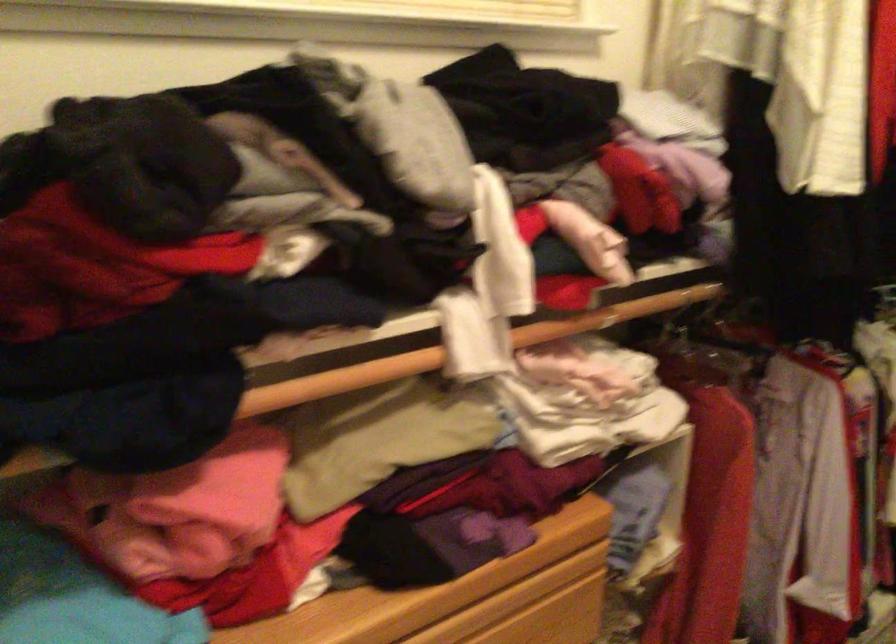
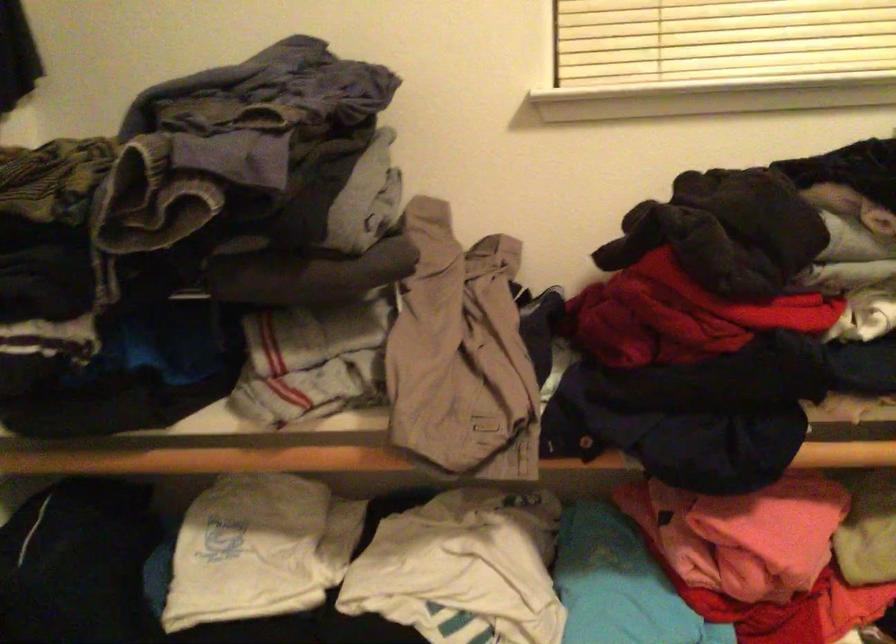
Question: The first image is from the beginning of the video and the second image is from the end. How did the camera likely rotate when shooting the video?

Choices:
 (A) Left
 (B) Right
 (C) Up
 (D) Down

Answer: (A)